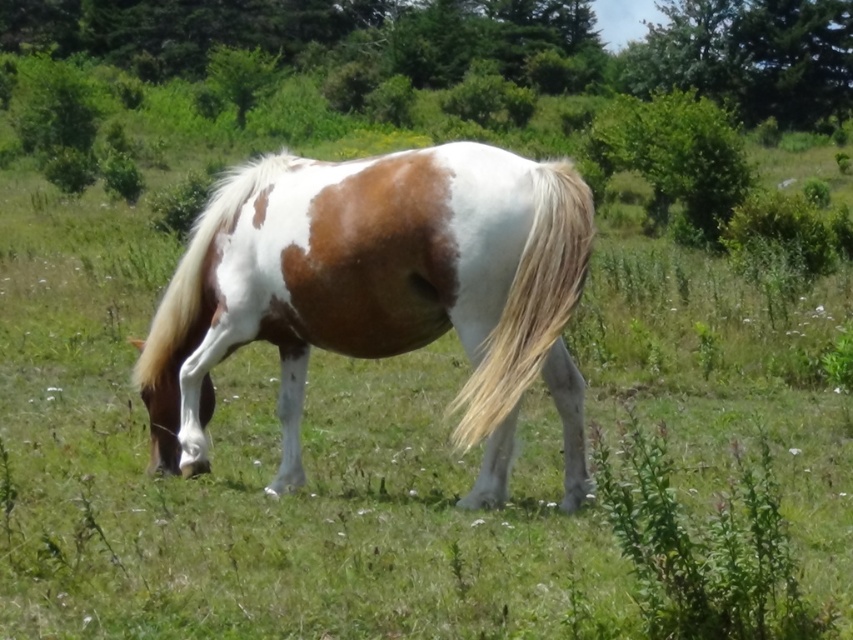
You are a photographer trying to capture the white and brown speckled horse at center and the blonde silky tail at center in a single shot. Based on their positions, will the horse appear higher or lower in the frame compared to its tail?

The white and brown speckled horse at center is located above the blonde silky tail at center, so the horse will appear higher in the frame than its tail.

You are standing at the point marked by the coordinate point at center. The horse is at point (379, 292). Which direction should you move to reach the horse?

The white and brown speckled horse at center is represented by point (379, 292), so you are already at the same location as the horse. No movement is necessary.

Consider the image. You are standing in the field and want to approach the white and brown speckled horse at center and the blonde silky tail at center. Which one should you target first to reach the closer one?

You should target the white and brown speckled horse at center first because it is closer to you than the blonde silky tail at center.